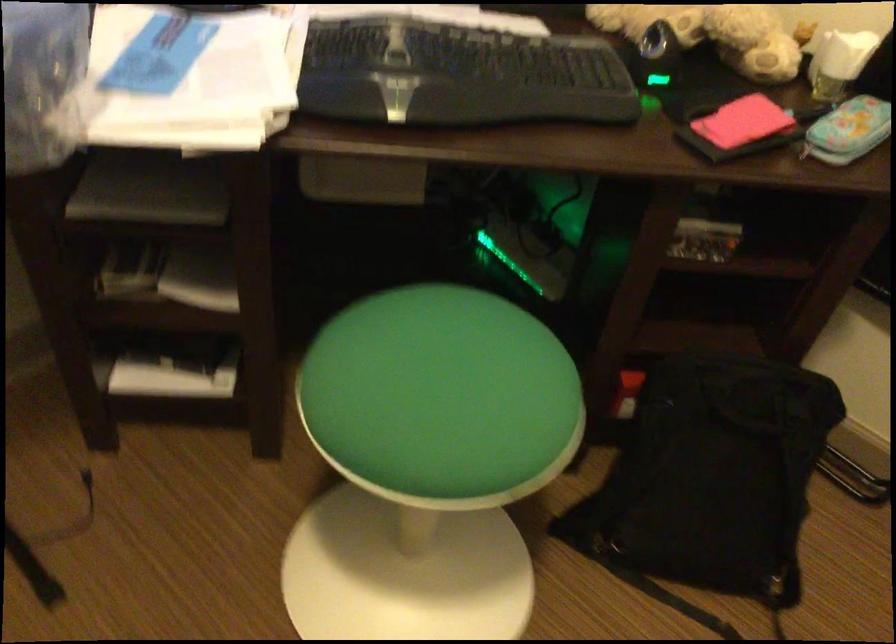
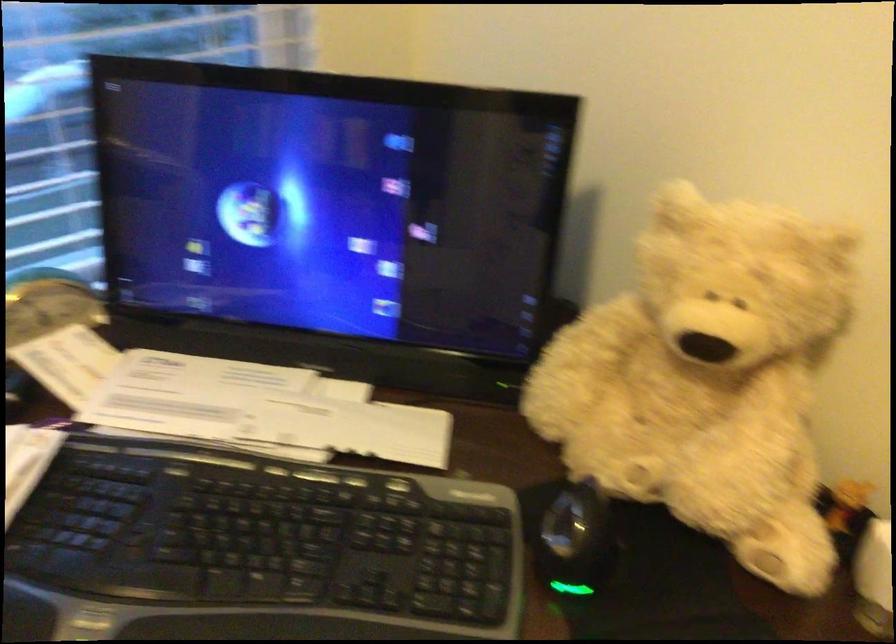
What movement of the cameraman would produce the second image?

The cameraman moved toward right, forward.